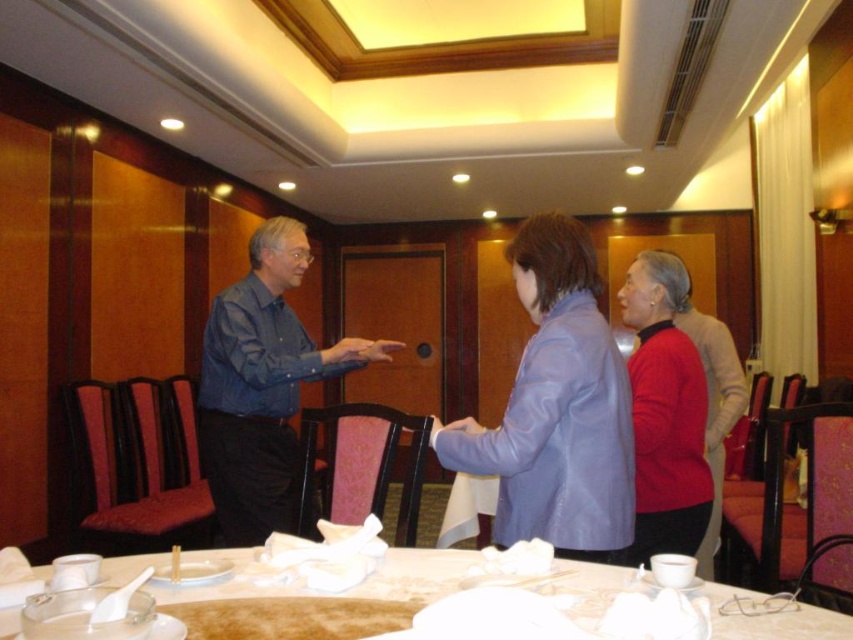
You are standing at the point labeled point [648,316] in the dining room. You want to walk straight towards the point labeled point [252,266]. Will you pass by the round table in the foreground?

Point [252,266] is behind point [648,316], so if you start at point [648,316] and walk straight towards point [252,266], you will pass by the round table in the foreground.

You are a photographer setting up for an event. You need to place a 12x12 inch square frame on the table between the blue shirt at center and the matte red sweater at center. Given the size difference between them, which side of the frame should you align closer to the larger item?

The blue shirt at center is bigger than the matte red sweater at center. To ensure proper alignment, the frame should be positioned closer to the blue shirt at center since it occupies more space, creating a balanced composition.

In the scene shown: You are a guest at a formal dinner and you see the matte red sweater at center. Where exactly would you look to find it?

The matte red sweater at center is located at the coordinates point (x=665, y=412).